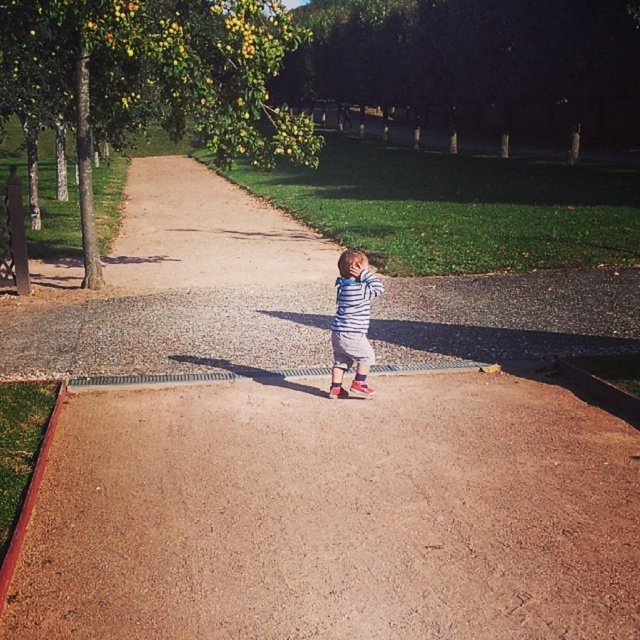
Which is more to the right, brown gravel dirt track at center or brown gravel path at center?

Positioned to the right is brown gravel dirt track at center.

Is point (344, 580) positioned behind point (150, 224)?

No.

At what (x,y) coordinates should I click in order to perform the action: click on brown gravel dirt track at center. Please return your answer as a coordinate pair (x, y). Looking at the image, I should click on 333,515.

What are the coordinates of `brown gravel dirt track at center` in the screenshot? It's located at (333, 515).

Is brown gravel path at center bigger than striped cotton shirt at center?

Yes.

Who is higher up, brown gravel path at center or striped cotton shirt at center?

Positioned higher is brown gravel path at center.

Which is behind, point (124, 288) or point (364, 296)?

The point (124, 288) is more distant.

The image size is (640, 640). I want to click on brown gravel path at center, so click(x=205, y=234).

Is the position of brown gravel dirt track at center less distant than that of striped cotton shirt at center?

That is True.

Which of these two, brown gravel dirt track at center or striped cotton shirt at center, stands shorter?

Standing shorter between the two is brown gravel dirt track at center.

Is point (621, 467) positioned in front of point (365, 348)?

Yes, point (621, 467) is in front of point (365, 348).

Find the location of a particular element. The height and width of the screenshot is (640, 640). brown gravel dirt track at center is located at coordinates (333, 515).